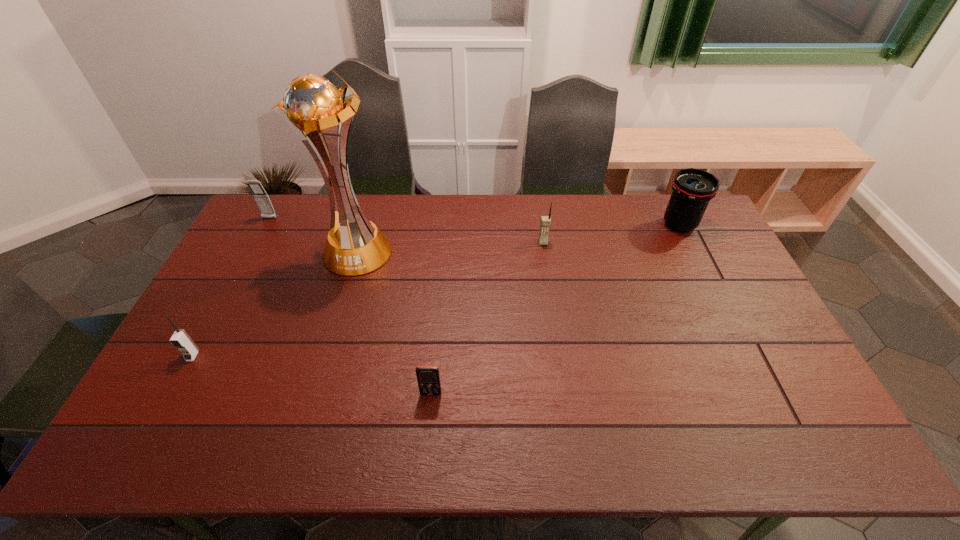
I want to click on vacant space located on the left of the rightmost object, so click(646, 225).

Where is `vacant region located on the front-facing side of the farthest cellular telephone`? Image resolution: width=960 pixels, height=540 pixels. vacant region located on the front-facing side of the farthest cellular telephone is located at coordinates (230, 291).

At what (x,y) coordinates should I click in order to perform the action: click on free space located 0.350m on the front of the rightmost cellular telephone, where the keypad is located. Please return your answer as a coordinate pair (x, y). The width and height of the screenshot is (960, 540). Looking at the image, I should click on click(x=556, y=327).

This screenshot has width=960, height=540. What are the coordinates of `vacant space located on the front-facing side of the fifth farthest object` in the screenshot? It's located at (162, 414).

Where is `free space located 0.100m on the screen of the nearest cellular telephone`? free space located 0.100m on the screen of the nearest cellular telephone is located at coordinates (427, 434).

Identify the location of trophy that is at the far edge. (312, 105).

Identify the location of telephoto lens that is at the far edge. (692, 188).

In order to click on cellular telephone present at the far edge in this screenshot , I will do `click(262, 199)`.

Find the location of a particular element. This screenshot has width=960, height=540. object that is at the right edge is located at coordinates (692, 188).

This screenshot has height=540, width=960. I want to click on object located at the far left corner, so [x=262, y=199].